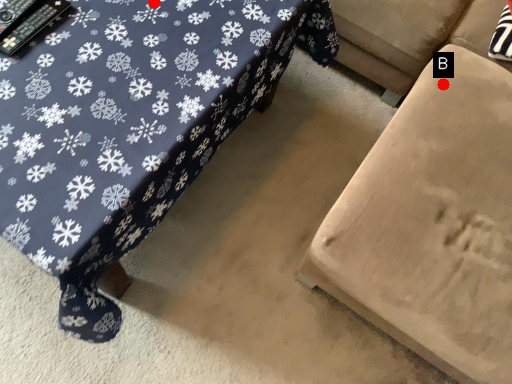
Question: Two points are circled on the image, labeled by A and B beside each circle. Which point is closer to the camera taking this photo?

Choices:
 (A) A is closer
 (B) B is closer

Answer: (A)